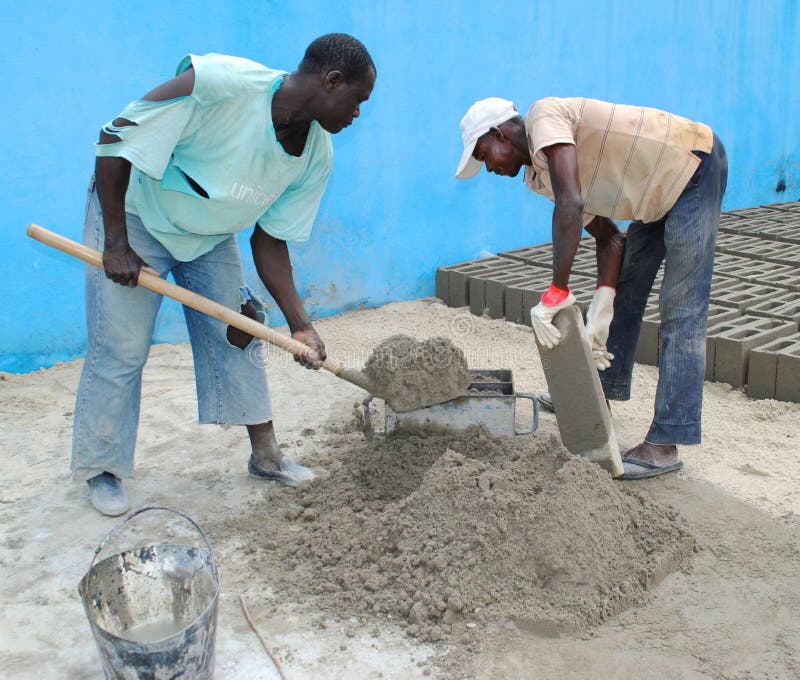
This screenshot has height=680, width=800. Identify the location of blue wall. tap(676, 79).